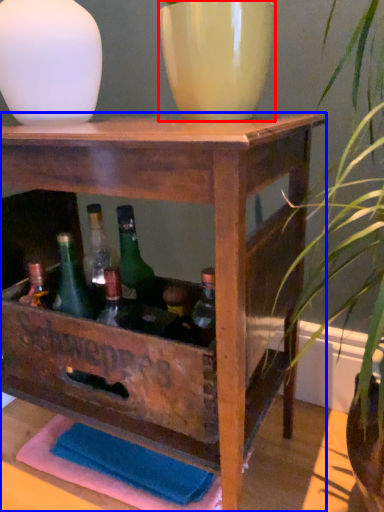
Question: Which point is closer to the camera, flowerpot (highlighted by a red box) or table (highlighted by a blue box)?

Choices:
 (A) flowerpot
 (B) table

Answer: (B)